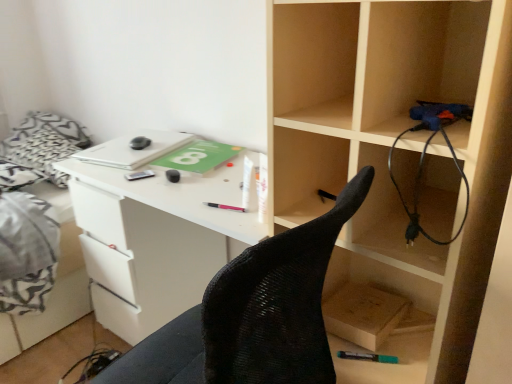
Locate an element on the screen. vacant space behind metallic silver pen at center, marked as the 1th stationery in a back-to-front arrangement is located at coordinates (147, 164).